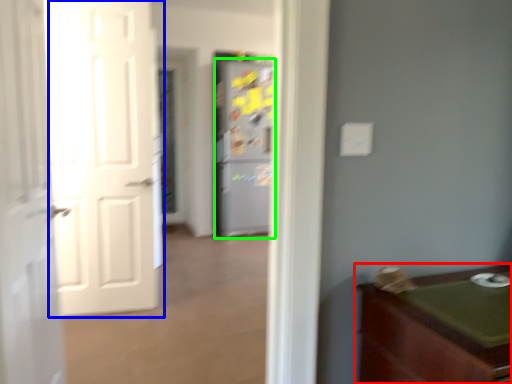
Question: Which object is the closest to the cabinetry (highlighted by a red box)? Choose among these: door (highlighted by a blue box) or refrigerator (highlighted by a green box).

Choices:
 (A) door
 (B) refrigerator

Answer: (A)